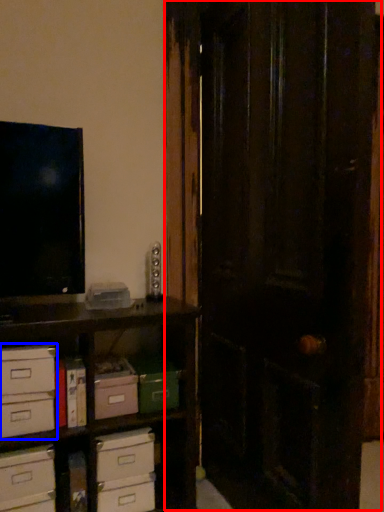
Question: Which object is closer to the camera taking this photo, door (highlighted by a red box) or chest of drawers (highlighted by a blue box)?

Choices:
 (A) door
 (B) chest of drawers

Answer: (A)